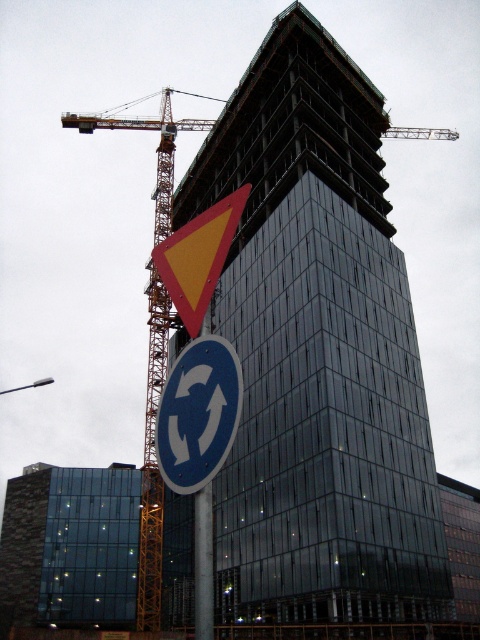
Question: Is yellowmetalliccrane at left further to the viewer compared to yellowmaterial/texturesign at upper center?

Choices:
 (A) yes
 (B) no

Answer: (A)

Question: Can you confirm if glassy steel tower at center is thinner than yellowmetalliccrane at left?

Choices:
 (A) yes
 (B) no

Answer: (A)

Question: Which point is farther from the camera taking this photo?

Choices:
 (A) (160, 584)
 (B) (238, 378)

Answer: (A)

Question: From the image, what is the correct spatial relationship of glassy steel tower at center in relation to blue metallic sign at lower center?

Choices:
 (A) below
 (B) above

Answer: (B)

Question: Which object is positioned closest to the yellowmetalliccrane at left?

Choices:
 (A) yellowmaterial/texturesign at upper center
 (B) glassy steel tower at center
 (C) blue metallic sign at lower center

Answer: (B)

Question: Which point is farther from the camera taking this photo?

Choices:
 (A) click(324, 364)
 (B) click(164, 289)

Answer: (B)